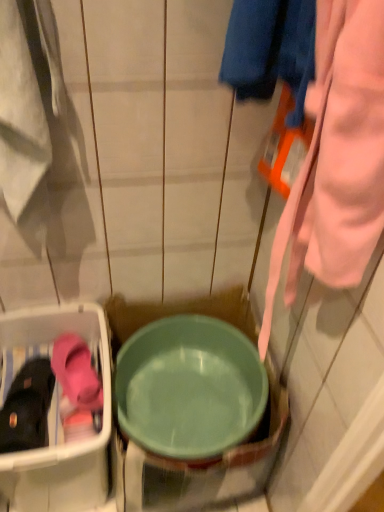
In order to click on green plastic basin at center in this screenshot , I will do `click(189, 387)`.

What do you see at coordinates (189, 387) in the screenshot? The height and width of the screenshot is (512, 384). I see `green plastic basin at center` at bounding box center [189, 387].

Image resolution: width=384 pixels, height=512 pixels. What do you see at coordinates (27, 407) in the screenshot?
I see `matte pink slipper at lower left` at bounding box center [27, 407].

The image size is (384, 512). What are the coordinates of `matte pink slipper at lower left` in the screenshot? It's located at (27, 407).

You are a GUI agent. You are given a task and a screenshot of the screen. Output one action in this format:
    pyautogui.click(x=<x>, y=<y>)
    Task: Click on the green plastic basin at center
    This screenshot has height=512, width=384.
    Given the screenshot: What is the action you would take?
    pyautogui.click(x=189, y=387)

Is matte pink slipper at lower left to the left of green plastic basin at center from the viewer's perspective?

Yes, matte pink slipper at lower left is to the left of green plastic basin at center.

Considering their positions, is matte pink slipper at lower left located in front of or behind green plastic basin at center?

Clearly, matte pink slipper at lower left is behind green plastic basin at center.

Considering the points (37, 362) and (154, 362), which point is behind, point (37, 362) or point (154, 362)?

Positioned behind is point (154, 362).

From the image's perspective, relative to green plastic basin at center, is matte pink slipper at lower left above or below?

matte pink slipper at lower left is situated higher than green plastic basin at center in the image.

From a real-world perspective, is matte pink slipper at lower left positioned over green plastic basin at center based on gravity?

Indeed, from a real-world perspective, matte pink slipper at lower left stands above green plastic basin at center.

Considering the sizes of objects matte pink slipper at lower left and green plastic basin at center in the image provided, who is thinner, matte pink slipper at lower left or green plastic basin at center?

With smaller width is matte pink slipper at lower left.

Which of these two, matte pink slipper at lower left or green plastic basin at center, stands taller?

green plastic basin at center is taller.

Between matte pink slipper at lower left and green plastic basin at center, which one has smaller size?

matte pink slipper at lower left.

Is matte pink slipper at lower left not inside green plastic basin at center?

matte pink slipper at lower left lies outside green plastic basin at center's area.

Does matte pink slipper at lower left touch green plastic basin at center?

No, matte pink slipper at lower left is not with green plastic basin at center.

Is matte pink slipper at lower left oriented towards green plastic basin at center?

No.

How many degrees apart are the facing directions of matte pink slipper at lower left and green plastic basin at center?

matte pink slipper at lower left and green plastic basin at center are facing 12.9 degrees away from each other.

You are a GUI agent. You are given a task and a screenshot of the screen. Output one action in this format:
    pyautogui.click(x=<x>, y=<y>)
    Task: Click on the basin in front of the matte pink slipper at lower left
    This screenshot has height=512, width=384.
    Given the screenshot: What is the action you would take?
    pyautogui.click(x=189, y=387)

Is green plastic basin at center to the left of matte pink slipper at lower left from the viewer's perspective?

In fact, green plastic basin at center is to the right of matte pink slipper at lower left.

Is green plastic basin at center in front of or behind matte pink slipper at lower left in the image?

In the image, green plastic basin at center appears in front of matte pink slipper at lower left.

Which point is more forward, (199,449) or (21,424)?

Point (21,424)

Based on the photo, from the image's perspective, would you say green plastic basin at center is shown under matte pink slipper at lower left?

Indeed, from the image's perspective, green plastic basin at center is shown beneath matte pink slipper at lower left.

From a real-world perspective, relative to matte pink slipper at lower left, is green plastic basin at center vertically above or below?

From a real-world perspective, green plastic basin at center is physically below matte pink slipper at lower left.

Looking at their sizes, would you say green plastic basin at center is wider or thinner than matte pink slipper at lower left?

green plastic basin at center is wider than matte pink slipper at lower left.

Is green plastic basin at center shorter than matte pink slipper at lower left?

Incorrect, the height of green plastic basin at center does not fall short of that of matte pink slipper at lower left.

Considering the relative sizes of green plastic basin at center and matte pink slipper at lower left in the image provided, is green plastic basin at center bigger than matte pink slipper at lower left?

Yes.

Can we say green plastic basin at center lies outside matte pink slipper at lower left?

Indeed, green plastic basin at center is completely outside matte pink slipper at lower left.

Are green plastic basin at center and matte pink slipper at lower left beside each other?

No, green plastic basin at center is not making contact with matte pink slipper at lower left.

Is green plastic basin at center oriented towards matte pink slipper at lower left?

No, green plastic basin at center is not facing towards matte pink slipper at lower left.

The image size is (384, 512). Find the location of `footwear above the green plastic basin at center (from a real-world perspective)`. footwear above the green plastic basin at center (from a real-world perspective) is located at coordinates (27, 407).

I want to click on footwear that appears on the left of green plastic basin at center, so click(x=27, y=407).

Where is `footwear above the green plastic basin at center (from the image's perspective)`? footwear above the green plastic basin at center (from the image's perspective) is located at coordinates [x=27, y=407].